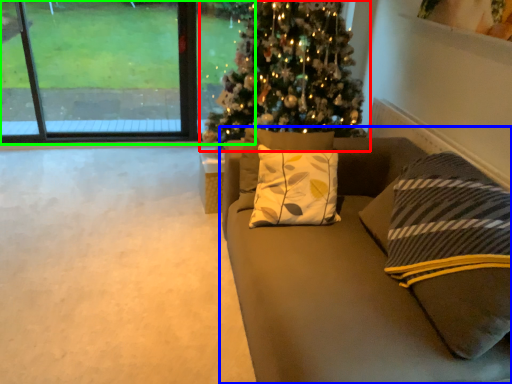
Question: Based on their relative distances, which object is nearer to christmas tree (highlighted by a red box)? Choose from studio couch (highlighted by a blue box) and window (highlighted by a green box).

Choices:
 (A) studio couch
 (B) window

Answer: (A)